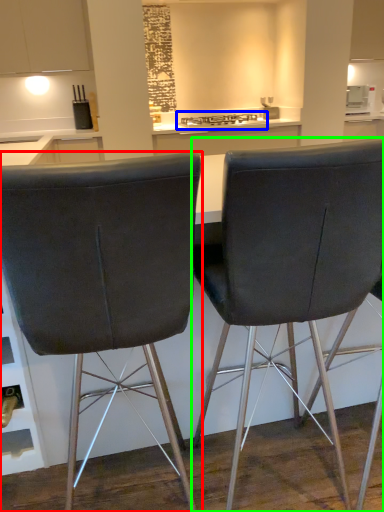
Question: Based on their relative distances, which object is farther from chair (highlighted by a red box)? Choose from gas stove (highlighted by a blue box) and chair (highlighted by a green box).

Choices:
 (A) gas stove
 (B) chair

Answer: (A)